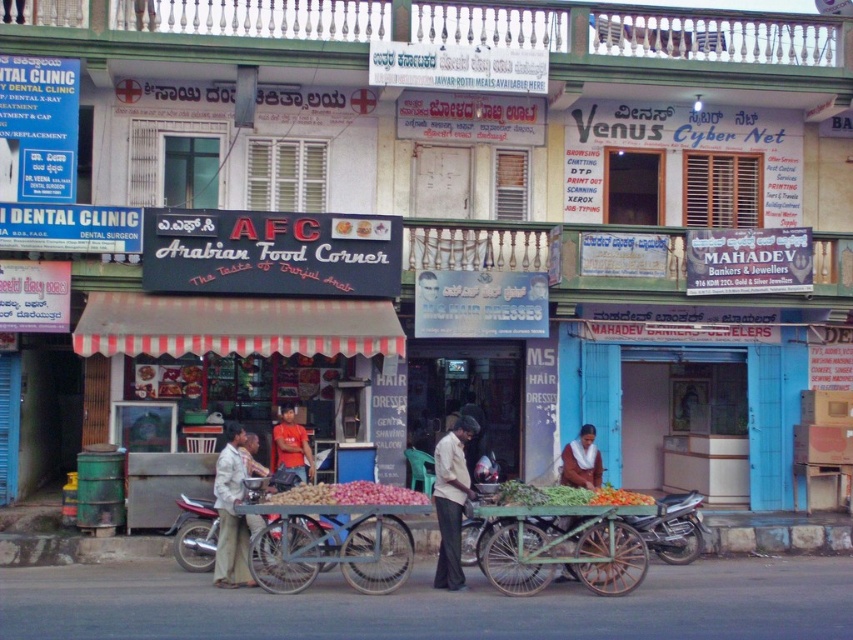
Identify the location of dark grey trousers at center. (451, 500).

Between dark grey trousers at center and light beige fabric pants at center, which one appears on the left side from the viewer's perspective?

light beige fabric pants at center

Find the location of a particular element. The height and width of the screenshot is (640, 853). dark grey trousers at center is located at coordinates (451, 500).

Locate an element on the screen. This screenshot has height=640, width=853. dark grey trousers at center is located at coordinates (451, 500).

Can you confirm if metallic cart at center is bigger than light beige fabric pants at center?

Yes.

Is metallic cart at center positioned before light beige fabric pants at center?

Yes.

Between point (407, 566) and point (236, 538), which one is positioned in front?

Point (407, 566) is in front.

Identify the location of metallic cart at center. (335, 536).

Which is in front, point (289, 490) or point (467, 429)?

Point (289, 490)

Who is higher up, metallic cart at center or dark grey trousers at center?

dark grey trousers at center

Is point (270, 509) in front of point (445, 525)?

Yes, point (270, 509) is closer to viewer.

Where is `metallic cart at center`? This screenshot has height=640, width=853. metallic cart at center is located at coordinates (335, 536).